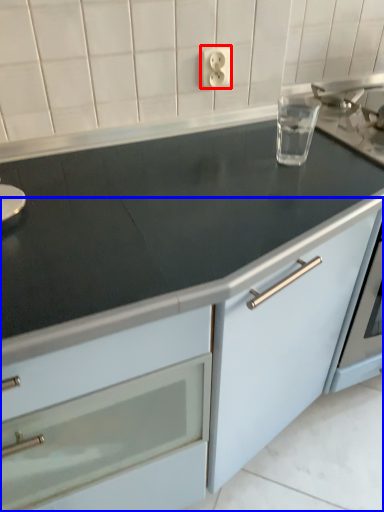
Question: Which point is further to the camera, electric outlet (highlighted by a red box) or cabinetry (highlighted by a blue box)?

Choices:
 (A) electric outlet
 (B) cabinetry

Answer: (A)